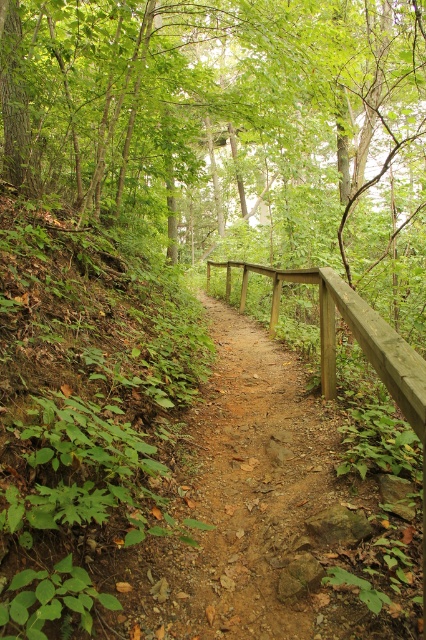
Who is positioned more to the left, green leafy tree at center or wooden rail at center?

Positioned to the left is wooden rail at center.

Is green leafy tree at center taller than wooden rail at center?

Yes.

This screenshot has width=426, height=640. What do you see at coordinates (232, 125) in the screenshot?
I see `green leafy tree at center` at bounding box center [232, 125].

At what (x,y) coordinates should I click in order to perform the action: click on green leafy tree at center. Please return your answer as a coordinate pair (x, y). This screenshot has height=640, width=426. Looking at the image, I should click on (232, 125).

Does green leafy hillside at left appear on the left side of wooden rail at center?

Yes, green leafy hillside at left is to the left of wooden rail at center.

Which is more to the right, green leafy hillside at left or wooden rail at center?

wooden rail at center is more to the right.

Is point (91, 536) more distant than point (382, 321)?

No.

Find the location of a particular element. green leafy hillside at left is located at coordinates (86, 422).

Based on the photo, can you confirm if green leafy tree at center is positioned above green leafy hillside at left?

Yes.

Does green leafy tree at center appear under green leafy hillside at left?

No.

Is point (42, 86) less distant than point (138, 392)?

No, it is behind (138, 392).

The image size is (426, 640). Identify the location of green leafy tree at center. (232, 125).